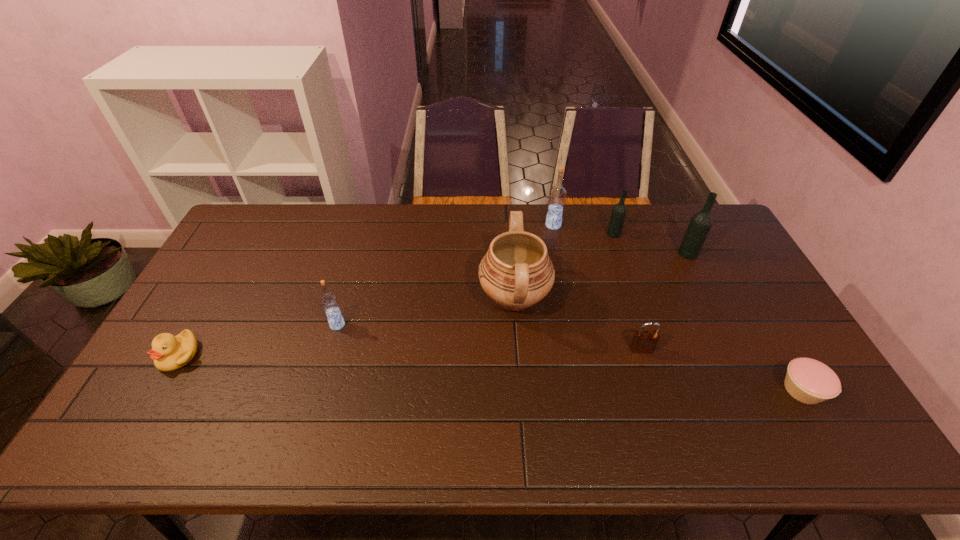
Where is `brown padlock`? Image resolution: width=960 pixels, height=540 pixels. brown padlock is located at coordinates (644, 341).

Locate an element on the screen. This screenshot has height=540, width=960. the leftmost object is located at coordinates (169, 352).

Where is `the second shortest object`? the second shortest object is located at coordinates (169, 352).

This screenshot has width=960, height=540. What are the coordinates of `the rightmost object` in the screenshot? It's located at (807, 380).

Identify the location of the shortest object. pyautogui.click(x=807, y=380).

At what (x,y) coordinates should I click in order to perform the action: click on blank space located on the left of the third farthest object. Please return your answer as a coordinate pair (x, y). Looking at the image, I should click on (629, 253).

This screenshot has height=540, width=960. I want to click on blank area located 0.070m on the back of the second vodka from left to right, so click(x=550, y=209).

Identify the location of free spot located on the front-facing side of the sixth object from right to left. (377, 298).

The height and width of the screenshot is (540, 960). I want to click on vacant area situated on the front-facing side of the sixth object from right to left, so click(x=413, y=298).

At what (x,y) coordinates should I click in order to perform the action: click on vacant area located 0.050m on the front-facing side of the sixth object from right to left. Please return your answer as a coordinate pair (x, y). Looking at the image, I should click on (462, 298).